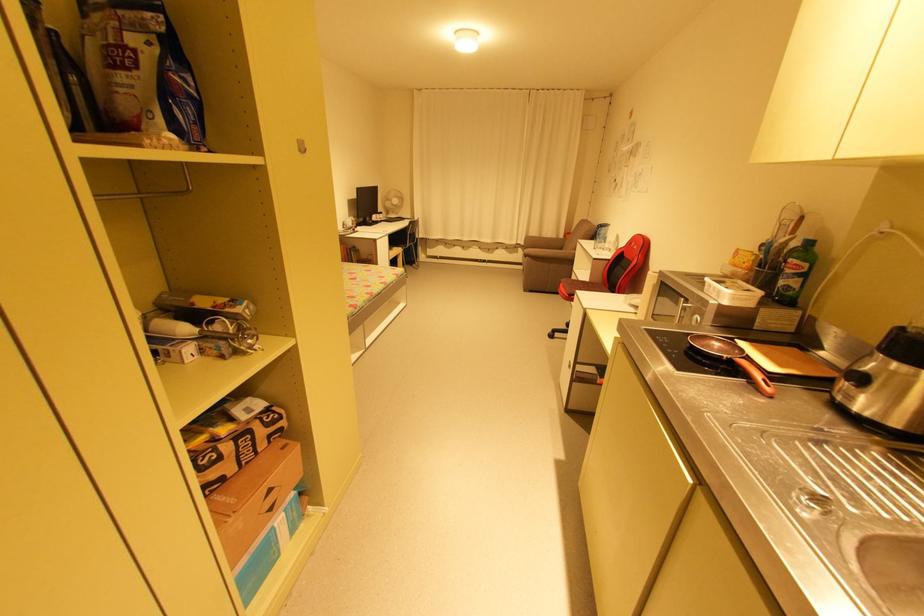
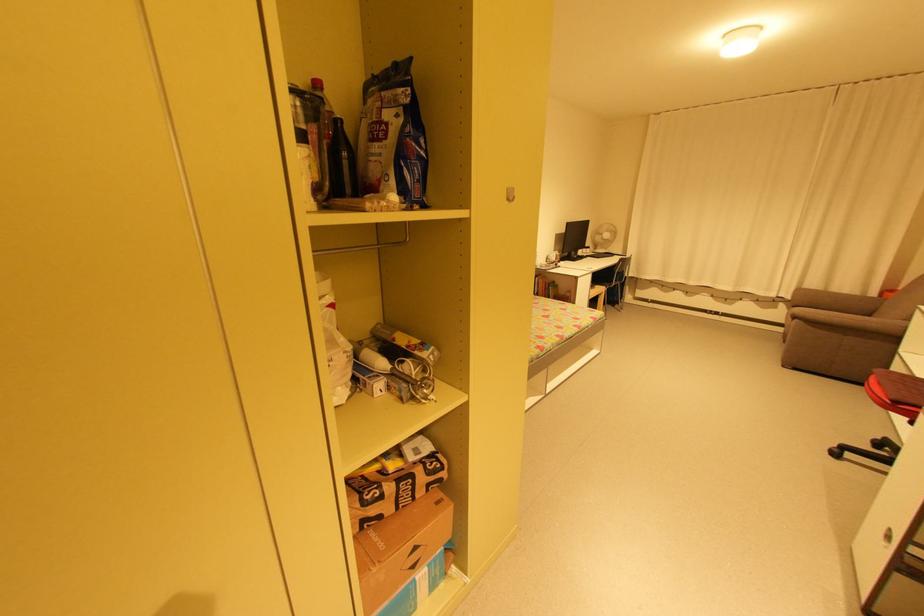
Find the pixel in the second image that matches (527,244) in the first image.

(794, 297)